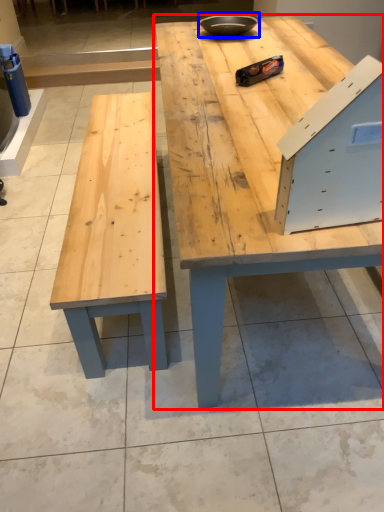
Question: Which of the following is the farthest to the observer, table (highlighted by a red box) or bowl (highlighted by a blue box)?

Choices:
 (A) table
 (B) bowl

Answer: (B)